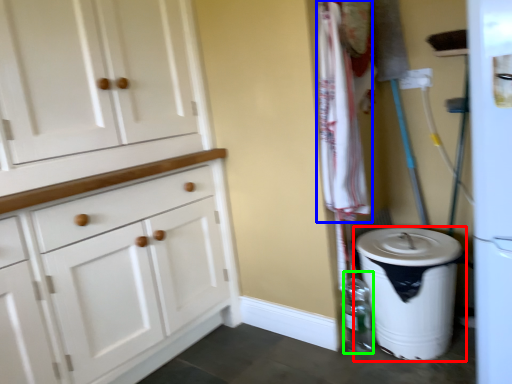
Question: Estimate the real-world distances between objects in this image. Which object is closer to waste container (highlighted by a red box), laundry (highlighted by a blue box) or bottle (highlighted by a green box)?

Choices:
 (A) laundry
 (B) bottle

Answer: (B)